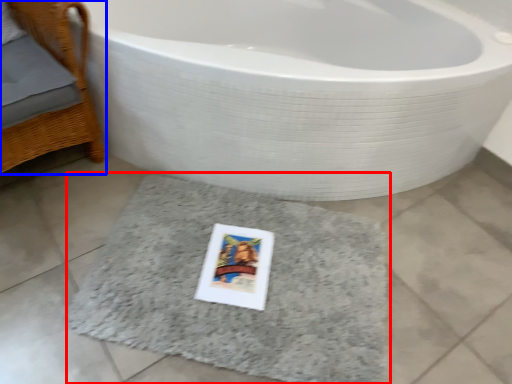
Question: Which object is closer to the camera taking this photo, bath mat (highlighted by a red box) or furniture (highlighted by a blue box)?

Choices:
 (A) bath mat
 (B) furniture

Answer: (B)